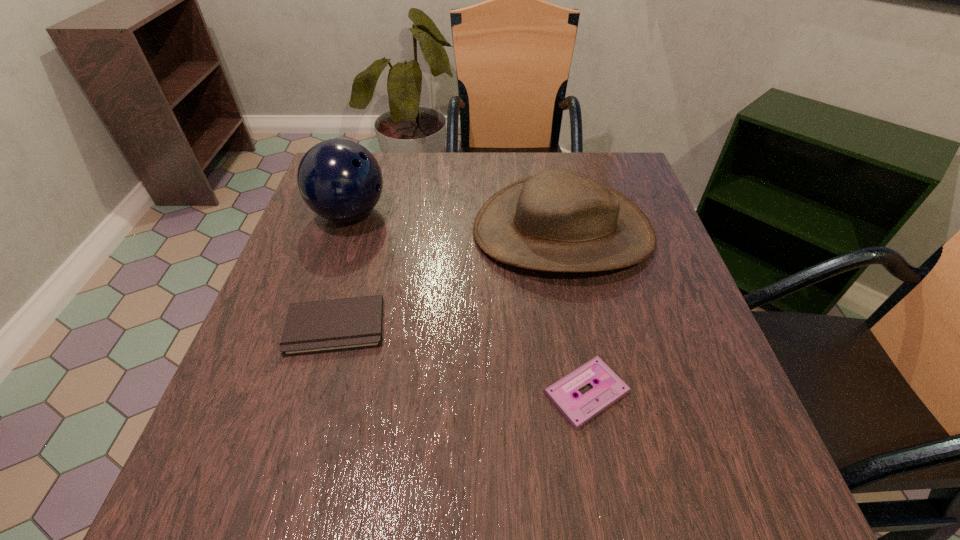
You are a GUI agent. You are given a task and a screenshot of the screen. Output one action in this format:
    pyautogui.click(x=<x>, y=<y>)
    Task: Click on the free space that satisfies the following two spatial constraints: 1. on the front side of the nearest object; 2. on the right side of the third farthest object
    
    Given the screenshot: What is the action you would take?
    coord(316,393)

This screenshot has height=540, width=960. Find the location of `vacant region that satisfies the following two spatial constraints: 1. on the surface of the checkbook near the finger holes; 2. on the left side of the bowling ball`. vacant region that satisfies the following two spatial constraints: 1. on the surface of the checkbook near the finger holes; 2. on the left side of the bowling ball is located at coordinates (312, 326).